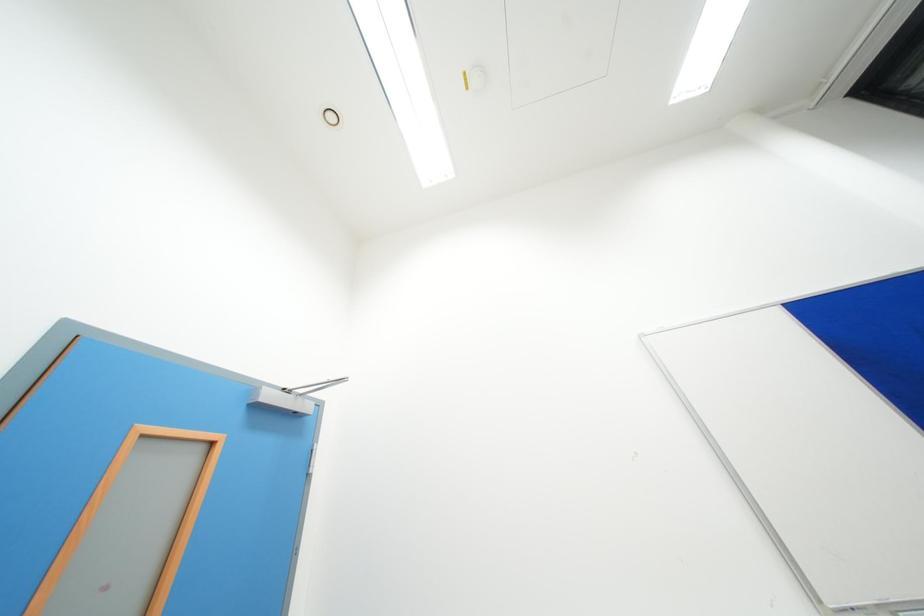
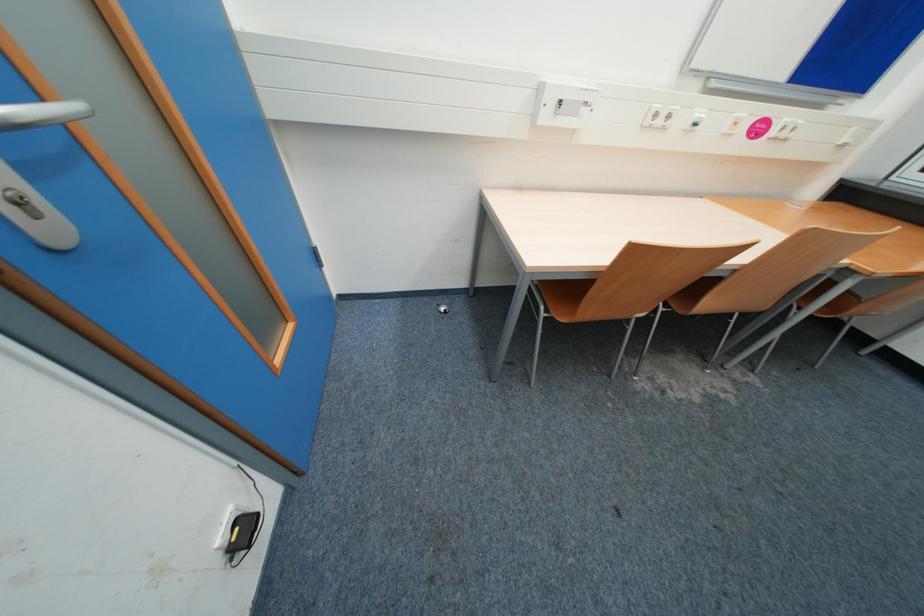
The images are taken continuously from a first-person perspective. In which direction is your viewpoint rotating?

The rotation direction of the camera is right-down.